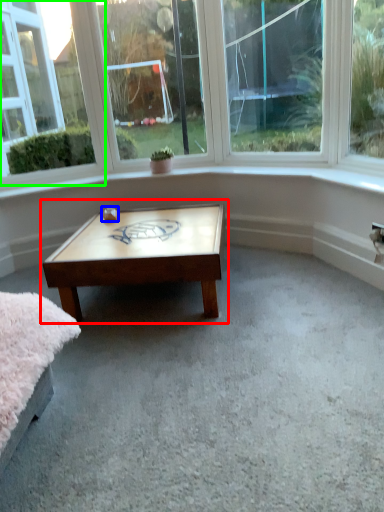
Question: Which object is the farthest from coffee table (highlighted by a red box)? Choose among these: table (highlighted by a blue box) or window (highlighted by a green box).

Choices:
 (A) table
 (B) window

Answer: (B)